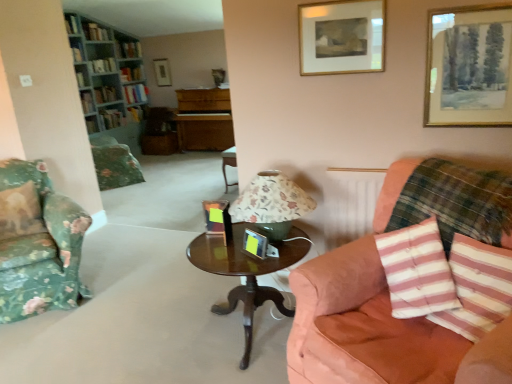
The height and width of the screenshot is (384, 512). I want to click on vacant region under dark wood coffee table at center (from a real-world perspective), so click(x=244, y=334).